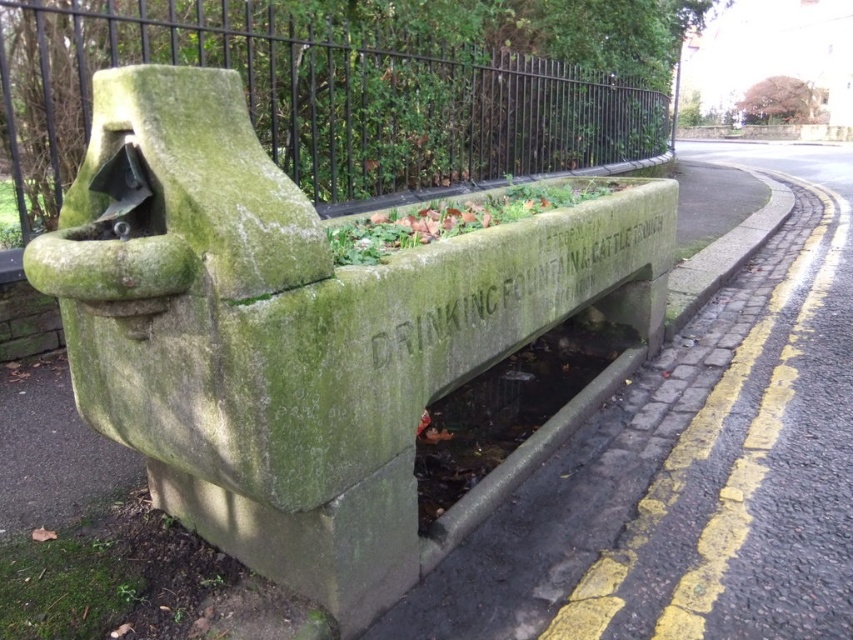
Question: Which of the following is the farthest from the observer?

Choices:
 (A) green mossy stone drinking fountain at center
 (B) green stone fence at upper left

Answer: (B)

Question: Does green stone drinking fountain at lower center have a lesser width compared to green stone fence at upper left?

Choices:
 (A) yes
 (B) no

Answer: (B)

Question: Is green stone drinking fountain at lower center wider than green stone fence at upper left?

Choices:
 (A) no
 (B) yes

Answer: (B)

Question: Among these points, which one is nearest to the camera?

Choices:
 (A) (283, 428)
 (B) (839, 324)
 (C) (430, 86)

Answer: (A)

Question: Is green mossy stone drinking fountain at center closer to the viewer compared to green stone fence at upper left?

Choices:
 (A) no
 (B) yes

Answer: (B)

Question: Which object is positioned farthest from the green stone fence at upper left?

Choices:
 (A) green mossy stone drinking fountain at center
 (B) green stone drinking fountain at lower center

Answer: (B)